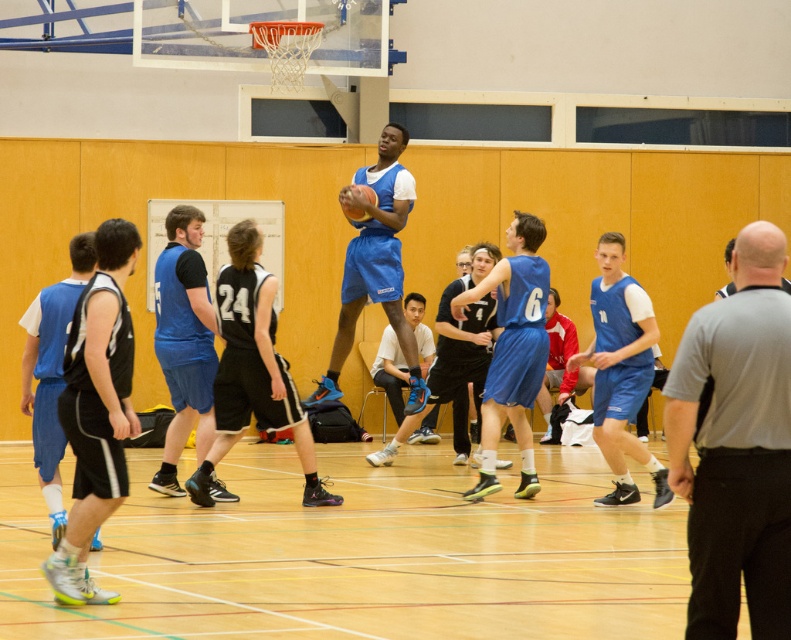
Question: Where is matte blue jersey at right located in relation to light gray fabric shirt at center in the image?

Choices:
 (A) left
 (B) right

Answer: (B)

Question: Observing the image, what is the correct spatial positioning of matte blue shorts at left in reference to glossy blue basketball at center?

Choices:
 (A) right
 (B) left

Answer: (B)

Question: Which point is closer to the camera?

Choices:
 (A) (63, 429)
 (B) (33, 420)
 (C) (517, 426)

Answer: (A)

Question: Among these objects, which one is nearest to the camera?

Choices:
 (A) matte blue jersey at right
 (B) matte blue jersey at center
 (C) matte blue shorts at left
 (D) matte blue shorts at center

Answer: (C)

Question: Can you confirm if matte blue shorts at center is positioned below matte blue basketball at center?

Choices:
 (A) no
 (B) yes

Answer: (B)

Question: Which point appears closest to the camera in this image?

Choices:
 (A) (21, 362)
 (B) (362, 220)
 (C) (665, 490)

Answer: (A)